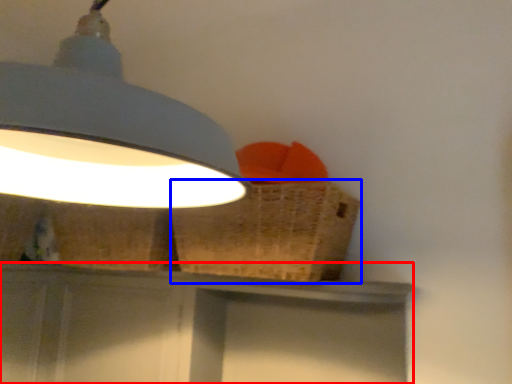
Question: Which object is closer to the camera taking this photo, vanity (highlighted by a red box) or basket (highlighted by a blue box)?

Choices:
 (A) vanity
 (B) basket

Answer: (B)